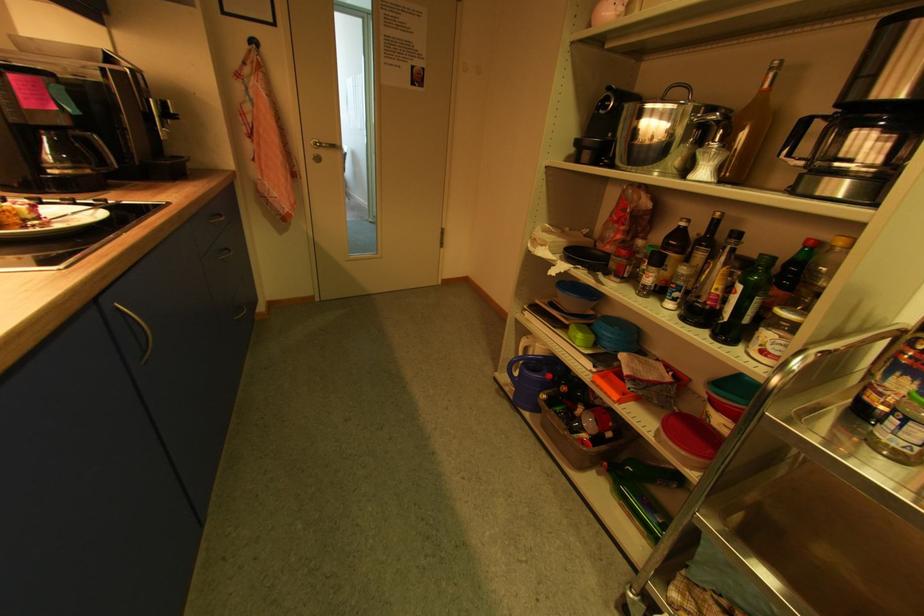
The image size is (924, 616). Describe the element at coordinates (139, 330) in the screenshot. I see `the blue cabinet handle` at that location.